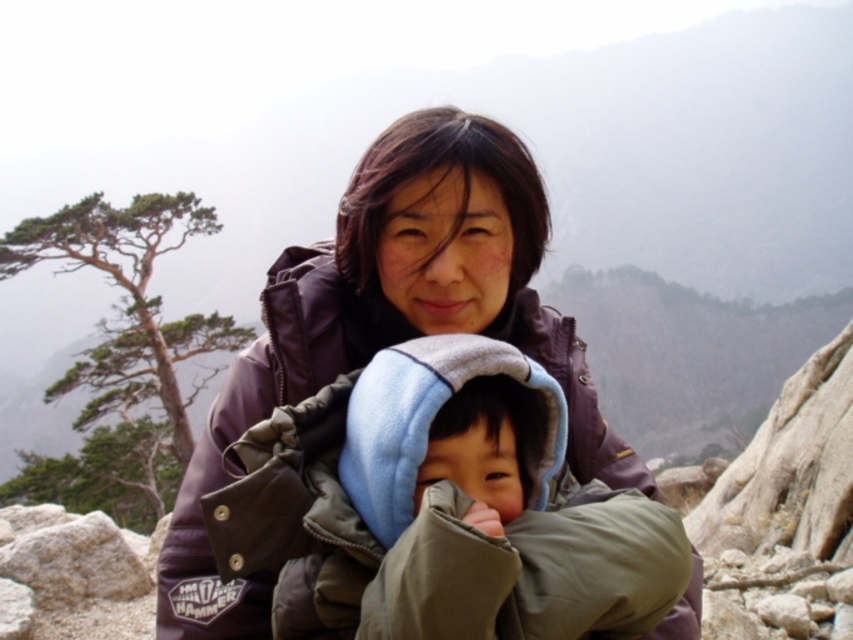
Based on the photo, you are a photographer trying to capture a photo of the two people in the scene. You want to ensure that both the light gray fleece jacket at center and the matte purple jacket at center are fully visible in the frame. Based on their heights, which jacket should you focus on to ensure both are in the shot?

The light gray fleece jacket at center is not as tall as the matte purple jacket at center, so focusing on the taller matte purple jacket at center will ensure both are visible in the frame.

Looking at this image, you are a photographer trying to capture both the light gray fleece jacket at center and the matte purple jacket at center in a single shot. Which jacket should you focus on first to ensure both are in frame?

The light gray fleece jacket at center is in front of the matte purple jacket at center, so you should focus on the matte purple jacket at center first to ensure both are in frame.